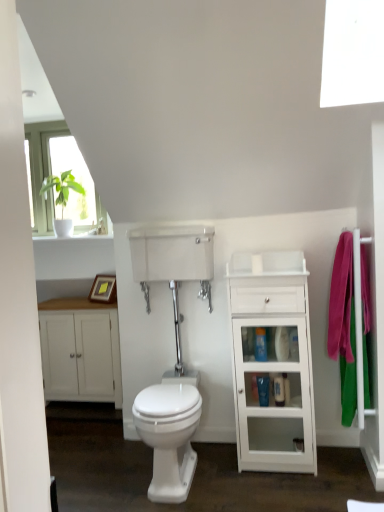
Question: Looking at their shapes, would you say white glossy bidet at center is wider or thinner than blue glossy toiletries at center, positioned as the 2th toiletry in right-to-left order?

Choices:
 (A) thin
 (B) wide

Answer: (B)

Question: From the image's perspective, is white glossy bidet at center above or below blue glossy toiletries at center, the first toiletry viewed from the top?

Choices:
 (A) above
 (B) below

Answer: (B)

Question: Estimate the real-world distances between objects in this image. Which object is closer to the blue glossy toiletries at center, which appears as the second toiletry when viewed from the left?

Choices:
 (A) white glossy bidet at center
 (B) pink fabric towel at right
 (C) white glossy cabinet at right
 (D) transparent plastic tank at center
 (E) blue glossy toiletries at center, the first toiletry viewed from the top

Answer: (E)

Question: Which of these objects is positioned farthest from the transparent plastic tank at center?

Choices:
 (A) pink fabric towel at right
 (B) white glossy bidet at center
 (C) white glossy cabinet at right
 (D) blue glossy toiletries at center, positioned as the 2th toiletry in right-to-left order
 (E) white matte cabinet at left

Answer: (A)